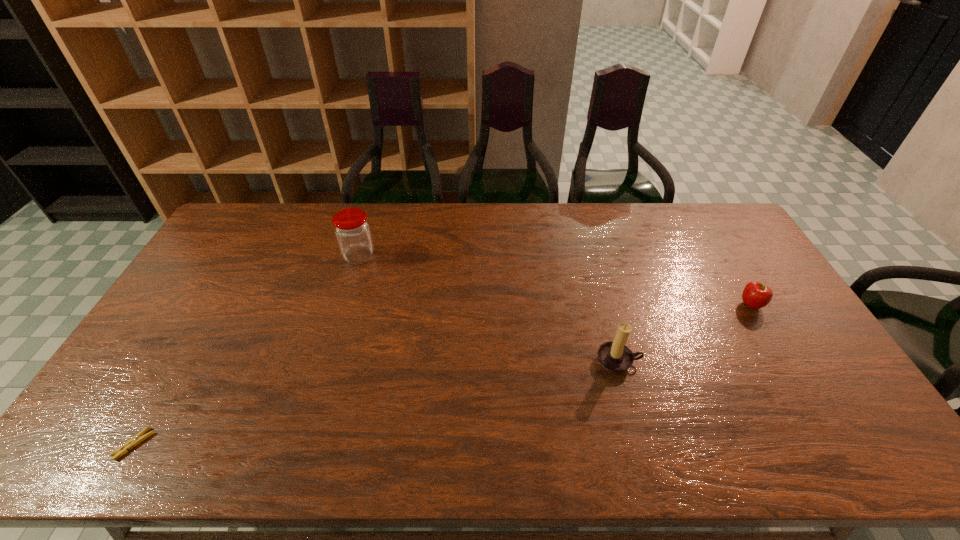
Where is `vacant point located between the second nearest object and the rightmost object`? The image size is (960, 540). vacant point located between the second nearest object and the rightmost object is located at coordinates (684, 333).

This screenshot has height=540, width=960. Identify the location of vacant space that's between the third object from right to left and the rightmost object. (555, 281).

The image size is (960, 540). What are the coordinates of `vacant space that's between the apple and the third farthest object` in the screenshot? It's located at click(x=684, y=333).

At what (x,y) coordinates should I click in order to perform the action: click on empty space that is in between the third nearest object and the third object from right to left. Please return your answer as a coordinate pair (x, y). Looking at the image, I should click on (555, 281).

Identify the location of vacant space that is in between the rightmost object and the candle holder. (684, 333).

Locate an element on the screen. Image resolution: width=960 pixels, height=540 pixels. vacant area that lies between the candle holder and the leftmost object is located at coordinates (376, 403).

The width and height of the screenshot is (960, 540). What are the coordinates of `vacant region between the candle holder and the nearest object` in the screenshot? It's located at pos(376,403).

Where is `free space that is in between the rightmost object and the third object from left to right`? This screenshot has height=540, width=960. free space that is in between the rightmost object and the third object from left to right is located at coordinates (684, 333).

I want to click on free space between the apple and the second object from right to left, so click(684, 333).

Identify the location of unoccupied area between the second nearest object and the second shortest object. (684, 333).